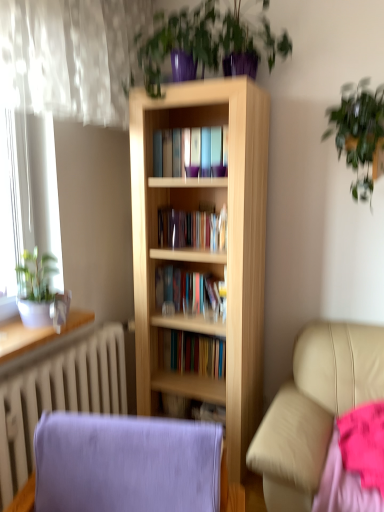
Question: From a real-world perspective, is light wood bookcase at center located higher than white glossy radiator at lower left?

Choices:
 (A) no
 (B) yes

Answer: (B)

Question: From a real-world perspective, is light wood bookcase at center located beneath white glossy radiator at lower left?

Choices:
 (A) no
 (B) yes

Answer: (A)

Question: Is light wood bookcase at center not close to white glossy radiator at lower left?

Choices:
 (A) yes
 (B) no

Answer: (B)

Question: Would you say white glossy radiator at lower left is part of light wood bookcase at center's contents?

Choices:
 (A) yes
 (B) no

Answer: (B)

Question: Considering the relative sizes of light wood bookcase at center and white glossy radiator at lower left in the image provided, is light wood bookcase at center thinner than white glossy radiator at lower left?

Choices:
 (A) yes
 (B) no

Answer: (B)

Question: Considering the positions of light wood bookcase at center and green leafy plant at upper right, the first houseplant positioned from the right, in the image, is light wood bookcase at center wider or thinner than green leafy plant at upper right, the first houseplant positioned from the right,?

Choices:
 (A) wide
 (B) thin

Answer: (A)

Question: Considering the positions of light wood bookcase at center and green leafy plant at upper right, the 2th houseplant ordered from the bottom, in the image, is light wood bookcase at center bigger or smaller than green leafy plant at upper right, the 2th houseplant ordered from the bottom,?

Choices:
 (A) big
 (B) small

Answer: (A)

Question: Considering their positions, is light wood bookcase at center located in front of or behind green leafy plant at upper right, the second houseplant from the top?

Choices:
 (A) behind
 (B) front

Answer: (A)

Question: Considering the positions of point (145, 375) and point (362, 116), is point (145, 375) closer or farther from the camera than point (362, 116)?

Choices:
 (A) farther
 (B) closer

Answer: (A)

Question: Is purple fabric rocking chair at lower left in front of or behind light wood bookcase at center in the image?

Choices:
 (A) behind
 (B) front

Answer: (B)

Question: Does point (99, 466) appear closer or farther from the camera than point (249, 340)?

Choices:
 (A) farther
 (B) closer

Answer: (B)

Question: Considering the positions of purple fabric rocking chair at lower left and light wood bookcase at center in the image, is purple fabric rocking chair at lower left bigger or smaller than light wood bookcase at center?

Choices:
 (A) big
 (B) small

Answer: (B)

Question: Looking at their shapes, would you say purple fabric rocking chair at lower left is wider or thinner than light wood bookcase at center?

Choices:
 (A) thin
 (B) wide

Answer: (B)

Question: Considering the positions of point (41, 472) and point (382, 497), is point (41, 472) closer or farther from the camera than point (382, 497)?

Choices:
 (A) closer
 (B) farther

Answer: (A)

Question: From the image's perspective, relative to pink fabric at lower right, is purple fabric rocking chair at lower left above or below?

Choices:
 (A) below
 (B) above

Answer: (A)